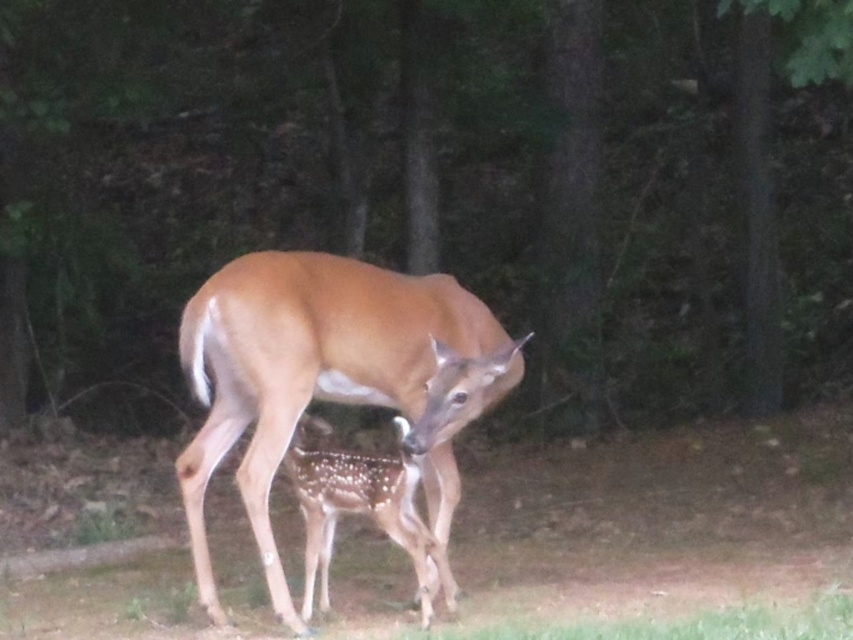
You are a wildlife photographer holding a camera with a 4.00 meter focal length lens. You want to take a photo of the brown velvet deer at center. Is your camera close enough to capture the deer without needing to zoom in further?

The brown velvet deer at center and camera are 4.30 meters apart. Since the focal length is 4.00 meters, the camera is slightly farther away than the focal length allows for capturing the deer without zooming. You might need to move closer or adjust the zoom.

You are a wildlife photographer aiming to capture the adult deer in the center of your photo. Given that the camera frame is centered at coordinate point (x=329, y=378), can you confirm if the brown velvet deer at center is positioned exactly at the center of the frame?

Yes, the point (x=329, y=378) corresponds to the brown velvet deer at center, so the adult deer is exactly at the center of the frame.

You are a wildlife photographer aiming to capture a closeup shot of both the brown velvet deer at center and the spotted fur fawn at center. Since you want to frame them side by side, which deer should you position on your left to maintain their natural positioning?

The spotted fur fawn at center should be positioned on your left because the brown velvet deer at center is naturally to the right of the spotted fur fawn at center.